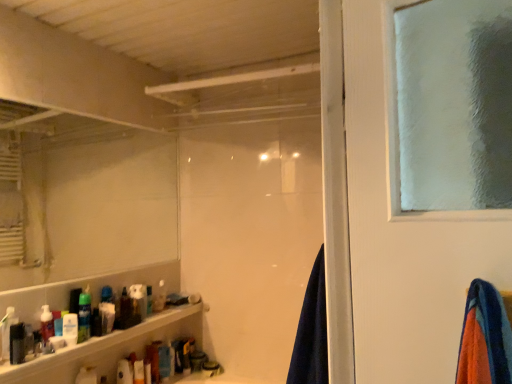
Question: Is translucent plastic bottles at lower left touching translucent plastic spray can at lower left, placed as the fifth toiletry when sorted from front to back?

Choices:
 (A) yes
 (B) no

Answer: (B)

Question: From a real-world perspective, is translucent plastic bottles at lower left located higher than translucent plastic spray can at lower left, which is counted as the 4th toiletry, starting from the back?

Choices:
 (A) yes
 (B) no

Answer: (B)

Question: Considering the relative sizes of translucent plastic bottles at lower left and translucent plastic spray can at lower left, placed as the fifth toiletry when sorted from front to back, in the image provided, is translucent plastic bottles at lower left smaller than translucent plastic spray can at lower left, placed as the fifth toiletry when sorted from front to back,?

Choices:
 (A) no
 (B) yes

Answer: (A)

Question: From the image's perspective, would you say translucent plastic bottles at lower left is positioned over translucent plastic spray can at lower left, placed as the fifth toiletry when sorted from front to back?

Choices:
 (A) yes
 (B) no

Answer: (B)

Question: Can you confirm if translucent plastic bottles at lower left is positioned to the right of translucent plastic spray can at lower left, which is counted as the 4th toiletry, starting from the back?

Choices:
 (A) no
 (B) yes

Answer: (B)

Question: Would you say matte black bottle at lower left, the first toiletry in the front-to-back sequence, is inside or outside white matte toothpaste tube at lower left, placed as the sixth toiletry when sorted from front to back?

Choices:
 (A) inside
 (B) outside

Answer: (B)

Question: Is matte black bottle at lower left, the first toiletry in the front-to-back sequence, to the left or to the right of white matte toothpaste tube at lower left, the third toiletry in the back-to-front sequence, in the image?

Choices:
 (A) left
 (B) right

Answer: (A)

Question: Is point (14, 355) positioned closer to the camera than point (104, 309)?

Choices:
 (A) closer
 (B) farther

Answer: (A)

Question: From the image's perspective, is matte black bottle at lower left, marked as the eighth toiletry in a back-to-front arrangement, located above or below white matte toothpaste tube at lower left, the third toiletry in the back-to-front sequence?

Choices:
 (A) above
 (B) below

Answer: (A)

Question: From a real-world perspective, relative to translucent plastic soap dispenser at lower left, which ranks as the sixth toiletry in back-to-front order, is white matte mirror at upper left vertically above or below?

Choices:
 (A) below
 (B) above

Answer: (B)

Question: Based on their positions, is white matte mirror at upper left located to the left or right of translucent plastic soap dispenser at lower left, which ranks as the sixth toiletry in back-to-front order?

Choices:
 (A) right
 (B) left

Answer: (A)

Question: Is white matte mirror at upper left in front of or behind translucent plastic soap dispenser at lower left, which ranks as the sixth toiletry in back-to-front order, in the image?

Choices:
 (A) behind
 (B) front

Answer: (A)

Question: Is point click(133, 261) positioned closer to the camera than point click(45, 322)?

Choices:
 (A) closer
 (B) farther

Answer: (B)

Question: Is point (47, 307) closer or farther from the camera than point (154, 309)?

Choices:
 (A) farther
 (B) closer

Answer: (B)

Question: Is translucent plastic soap dispenser at lower left, marked as the 3th toiletry in a front-to-back arrangement, taller or shorter than translucent plastic bottle at lower left, the eighth toiletry from the front?

Choices:
 (A) tall
 (B) short

Answer: (A)